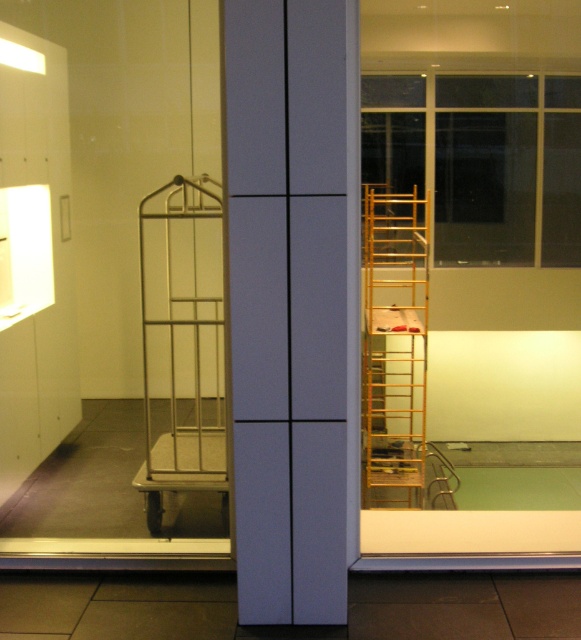
Question: Is silver metallic cart at left in front of gold metallic ladder at right?

Choices:
 (A) no
 (B) yes

Answer: (B)

Question: Which point is farther to the camera?

Choices:
 (A) gold metallic ladder at right
 (B) silver metallic cart at left
 (C) white matte cabinet at center

Answer: (A)

Question: Is white matte cabinet at center wider than gold metallic ladder at right?

Choices:
 (A) yes
 (B) no

Answer: (B)

Question: Which object is positioned farthest from the white matte cabinet at center?

Choices:
 (A) gold metallic ladder at right
 (B) silver metallic cart at left

Answer: (A)

Question: Which point is farther to the camera?

Choices:
 (A) click(279, 301)
 (B) click(187, 365)
 (C) click(367, 433)

Answer: (C)

Question: Observing the image, what is the correct spatial positioning of silver metallic cart at left in reference to gold metallic ladder at right?

Choices:
 (A) right
 (B) left

Answer: (B)